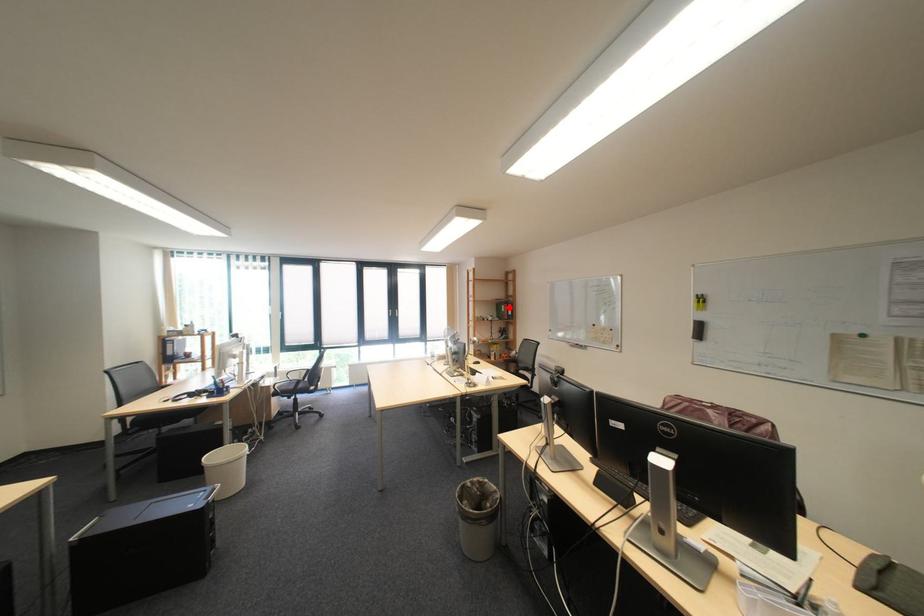
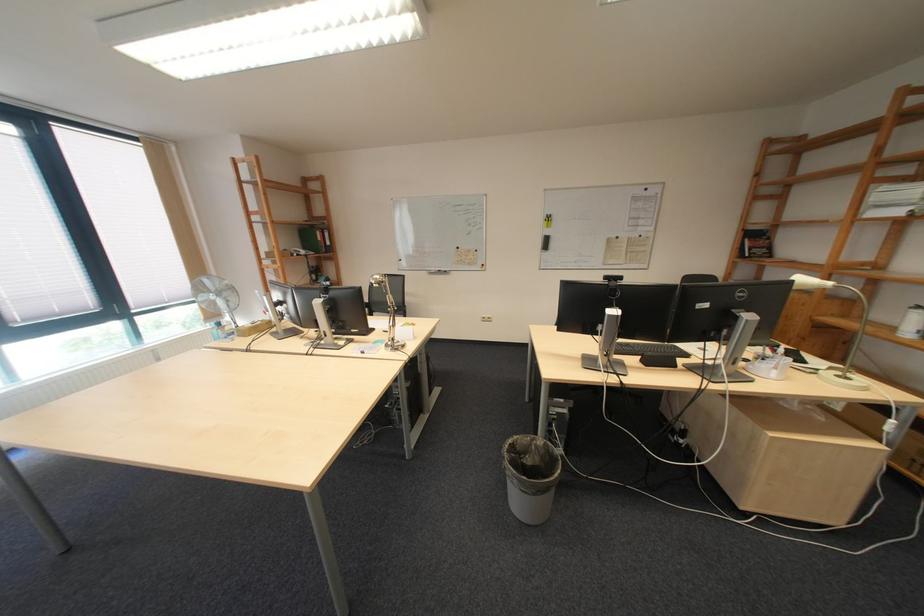
Find the pixel in the second image that matches the highlighted location in the first image.

(310, 233)